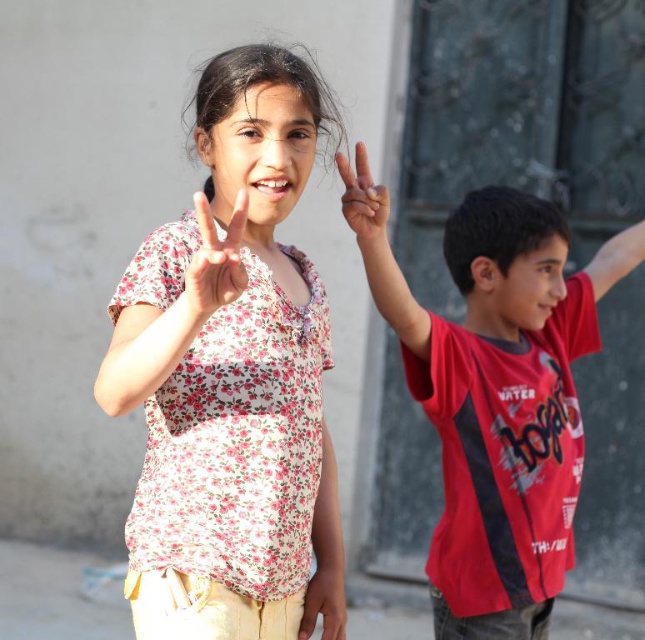
You are a photographer trying to capture the two children in the scene. You notice two points marked in the image. Which point is closer to the camera, point [459,232] or point [353,221]?

Point [459,232] is closer to the camera because it is further to the viewer than point [353,221].

You are a photographer trying to capture both the red matte shirt at right and the matte floral shirt at center in a single frame. Which child should you position closer to the camera to ensure both fit in the frame?

The red matte shirt at right is wider than the matte floral shirt at center. To ensure both fit in the frame, position the red matte shirt at right closer to the camera since its greater width requires more space.